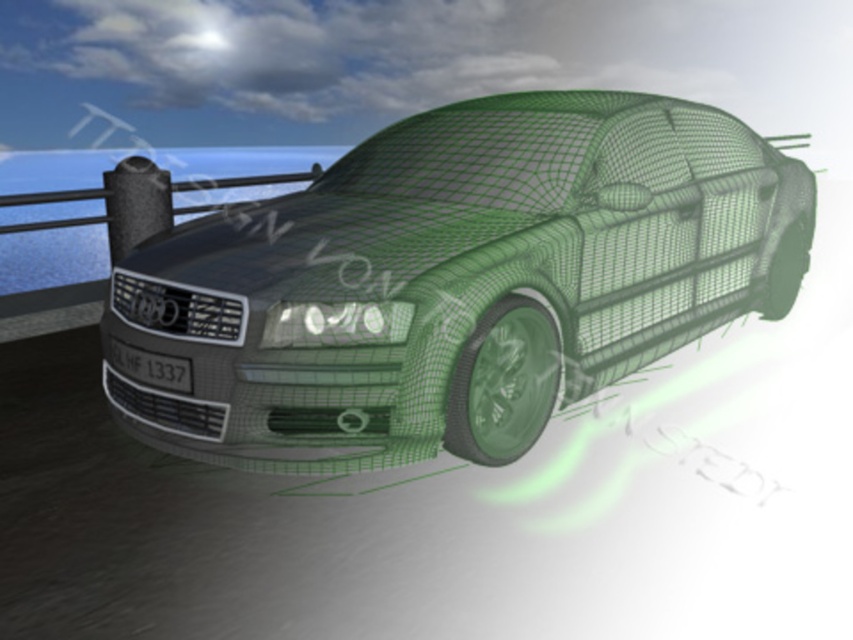
Question: Among these objects, which one is nearest to the camera?

Choices:
 (A) black plastic license plate at front
 (B) green wireframe car at center

Answer: (B)

Question: Does green wireframe car at center appear on the right side of black plastic license plate at front?

Choices:
 (A) no
 (B) yes

Answer: (B)

Question: Which object appears closest to the camera in this image?

Choices:
 (A) black plastic license plate at front
 (B) green wireframe car at center

Answer: (B)

Question: Can you confirm if green wireframe car at center is positioned above black plastic license plate at front?

Choices:
 (A) no
 (B) yes

Answer: (B)

Question: Which point appears closest to the camera in this image?

Choices:
 (A) (184, 365)
 (B) (598, 356)

Answer: (A)

Question: Is green wireframe car at center bigger than black plastic license plate at front?

Choices:
 (A) no
 (B) yes

Answer: (B)